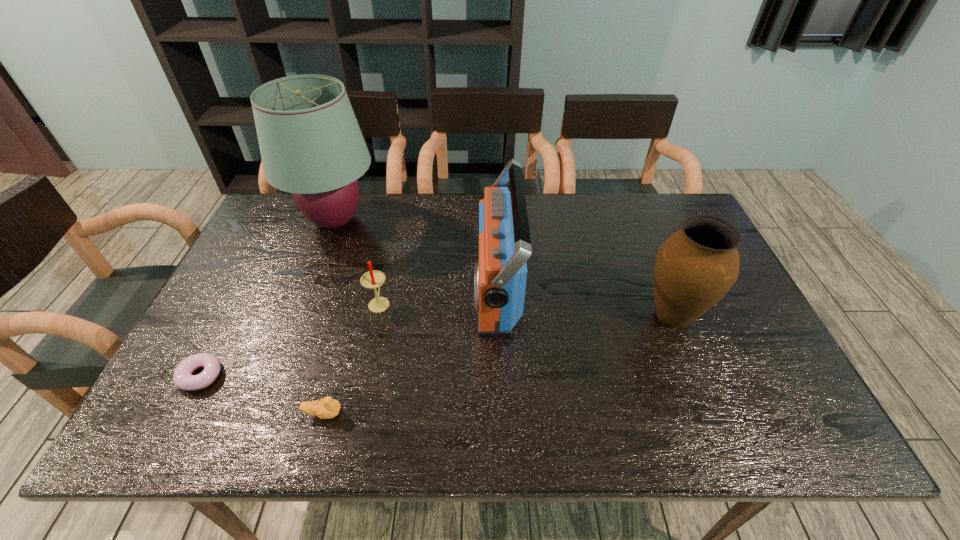
This screenshot has height=540, width=960. What are the coordinates of `object that is at the right edge` in the screenshot? It's located at (696, 266).

Locate an element on the screen. The image size is (960, 540). object present at the far left corner is located at coordinates (311, 145).

Locate an element on the screen. The height and width of the screenshot is (540, 960). blank space at the far edge is located at coordinates (405, 235).

In the image, there is a desktop. Where is `blank space at the near edge`? The width and height of the screenshot is (960, 540). blank space at the near edge is located at coordinates (292, 416).

In the image, there is a desktop. Find the location of `free region at the right edge`. free region at the right edge is located at coordinates (753, 383).

Where is `free space at the far left corner of the desktop`? The height and width of the screenshot is (540, 960). free space at the far left corner of the desktop is located at coordinates (277, 193).

Find the location of a particular element. The width and height of the screenshot is (960, 540). vacant area between the nearest object and the lampshade is located at coordinates (329, 317).

The image size is (960, 540). Identify the location of vacant space that is in between the candle and the nearest object. click(x=351, y=358).

This screenshot has height=540, width=960. What are the coordinates of `vacant region between the urn and the radio receiver` in the screenshot? It's located at (585, 302).

What are the coordinates of `free spot between the doughnut and the fifth object from left to right` in the screenshot? It's located at (348, 333).